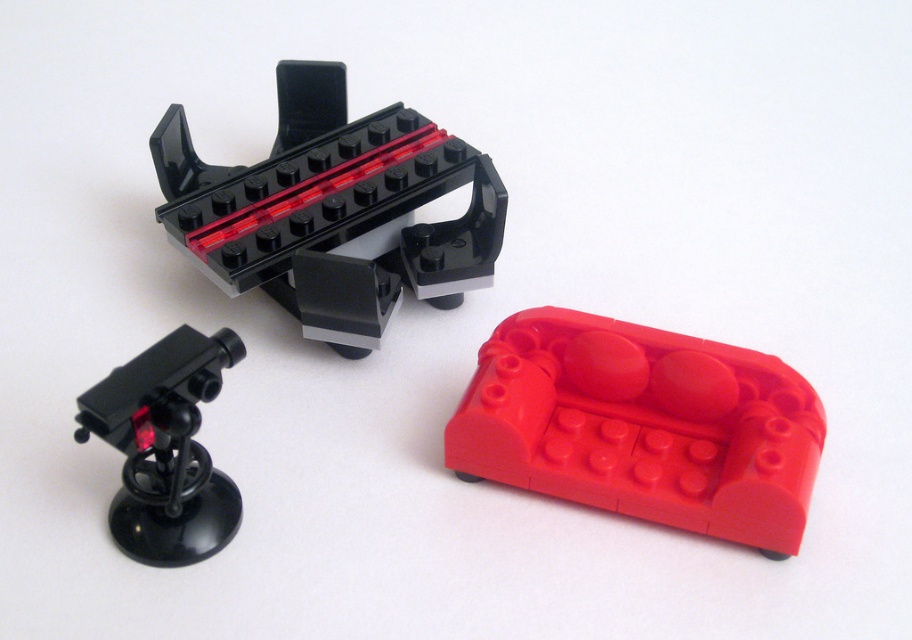
You are trying to place a rubber red couch at center and a matte black telescope at upper left in a small room. Which object should you place first to maximize space efficiency?

The rubber red couch at center is wider than the matte black telescope at upper left, so you should place the matte black telescope at upper left first to allow more space for the wider couch later.